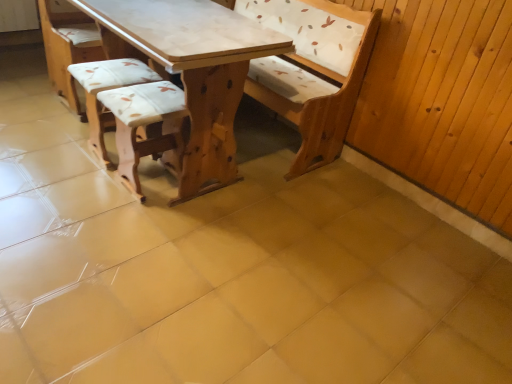
The image size is (512, 384). In order to click on white fabric cushion at center, the first armchair in the left-to-right sequence in this screenshot , I will do `click(106, 89)`.

Find the location of a particular element. Image resolution: width=512 pixels, height=384 pixels. wooden textured stool at center, which is the first armchair in right-to-left order is located at coordinates (143, 124).

From the picture: What is the approximate height of light brown wood table at center?

light brown wood table at center is 30.42 inches in height.

Image resolution: width=512 pixels, height=384 pixels. What are the coordinates of `white fabric cushion at center, the first armchair in the left-to-right sequence` in the screenshot? It's located at [106, 89].

Could you tell me if white fabric cushion at center, positioned as the 2th armchair in right-to-left order, is facing light brown wood table at center?

Yes, white fabric cushion at center, positioned as the 2th armchair in right-to-left order, is aimed at light brown wood table at center.

Is light brown wood table at center a part of white fabric cushion at center, positioned as the 2th armchair in right-to-left order?

No, light brown wood table at center is not surrounded by white fabric cushion at center, positioned as the 2th armchair in right-to-left order.

Is white fabric cushion at center, positioned as the 2th armchair in right-to-left order, taller than light brown wood table at center?

Incorrect, the height of white fabric cushion at center, positioned as the 2th armchair in right-to-left order, is not larger of that of light brown wood table at center.

From the image's perspective, is white fabric cushion at center, positioned as the 2th armchair in right-to-left order, above light brown wood table at center?

No, from the image's perspective, white fabric cushion at center, positioned as the 2th armchair in right-to-left order, is not on top of light brown wood table at center.

Does light brown wood table at center turn towards wooden textured stool at center, which is the first armchair in right-to-left order?

No, light brown wood table at center is not turned towards wooden textured stool at center, which is the first armchair in right-to-left order.

Consider the image. Is light brown wood table at center situated inside wooden textured stool at center, the second armchair positioned from the left, or outside?

light brown wood table at center exists outside the volume of wooden textured stool at center, the second armchair positioned from the left.

You are a GUI agent. You are given a task and a screenshot of the screen. Output one action in this format:
    pyautogui.click(x=<x>, y=<y>)
    Task: Click on the table above the wooden textured stool at center, the second armchair positioned from the left (from the image's perspective)
    
    Given the screenshot: What is the action you would take?
    pyautogui.click(x=183, y=84)

From the image's perspective, relative to wooden textured stool at center, the second armchair positioned from the left, is light brown wood table at center above or below?

light brown wood table at center is above wooden textured stool at center, the second armchair positioned from the left.

Which is in front, light brown wood table at center or white fabric cushion at center, positioned as the 2th armchair in right-to-left order?

light brown wood table at center is more forward.

Is light brown wood table at center facing away from white fabric cushion at center, positioned as the 2th armchair in right-to-left order?

No, light brown wood table at center is not facing the opposite direction of white fabric cushion at center, positioned as the 2th armchair in right-to-left order.

What are the coordinates of `table above the white fabric cushion at center, the first armchair in the left-to-right sequence (from the image's perspective)` in the screenshot? It's located at pyautogui.click(x=183, y=84).

Could you tell me if white fabric cushion at center, the first armchair in the left-to-right sequence, is facing wooden textured stool at center, the second armchair positioned from the left?

No, white fabric cushion at center, the first armchair in the left-to-right sequence, is not aimed at wooden textured stool at center, the second armchair positioned from the left.

Between point (157, 79) and point (117, 99), which one is positioned behind?

The point (157, 79) is behind.

Are white fabric cushion at center, the first armchair in the left-to-right sequence, and wooden textured stool at center, the second armchair positioned from the left, located far from each other?

They are positioned close to each other.

In terms of width, does white fabric cushion at center, positioned as the 2th armchair in right-to-left order, look wider or thinner when compared to wooden textured stool at center, the second armchair positioned from the left?

white fabric cushion at center, positioned as the 2th armchair in right-to-left order, is thinner than wooden textured stool at center, the second armchair positioned from the left.

Is wooden textured stool at center, the second armchair positioned from the left, aimed at light brown wood table at center?

Yes, wooden textured stool at center, the second armchair positioned from the left, is oriented towards light brown wood table at center.

Which is more to the right, wooden textured stool at center, which is the first armchair in right-to-left order, or light brown wood table at center?

light brown wood table at center is more to the right.

From the image's perspective, relative to light brown wood table at center, is wooden textured stool at center, the second armchair positioned from the left, above or below?

wooden textured stool at center, the second armchair positioned from the left, is situated lower than light brown wood table at center in the image.

Is wooden textured stool at center, which is the first armchair in right-to-left order, far away from light brown wood table at center?

No.

Considering the relative sizes of wooden textured stool at center, which is the first armchair in right-to-left order, and white fabric cushion at center, positioned as the 2th armchair in right-to-left order, in the image provided, is wooden textured stool at center, which is the first armchair in right-to-left order, thinner than white fabric cushion at center, positioned as the 2th armchair in right-to-left order,?

No.

Which of these two, wooden textured stool at center, the second armchair positioned from the left, or white fabric cushion at center, the first armchair in the left-to-right sequence, stands taller?

wooden textured stool at center, the second armchair positioned from the left.

From a real-world perspective, which is physically above, wooden textured stool at center, which is the first armchair in right-to-left order, or white fabric cushion at center, the first armchair in the left-to-right sequence?

In real-world perspective, wooden textured stool at center, which is the first armchair in right-to-left order, is above.

From the image's perspective, which one is positioned higher, wooden textured stool at center, which is the first armchair in right-to-left order, or white fabric cushion at center, the first armchair in the left-to-right sequence?

white fabric cushion at center, the first armchair in the left-to-right sequence.

Image resolution: width=512 pixels, height=384 pixels. I want to click on armchair that is the 2nd object to the left of the light brown wood table at center, starting at the anchor, so click(x=106, y=89).

Locate an element on the screen. The height and width of the screenshot is (384, 512). table that appears above the wooden textured stool at center, which is the first armchair in right-to-left order (from the image's perspective) is located at coordinates (183, 84).

Estimate the real-world distances between objects in this image. Which object is further from wooden textured stool at center, the second armchair positioned from the left, light brown wood table at center or white fabric cushion at center, positioned as the 2th armchair in right-to-left order?

white fabric cushion at center, positioned as the 2th armchair in right-to-left order.

Which object lies nearer to the anchor point white fabric cushion at center, the first armchair in the left-to-right sequence, wooden textured stool at center, the second armchair positioned from the left, or light brown wood table at center?

Among the two, wooden textured stool at center, the second armchair positioned from the left, is located nearer to white fabric cushion at center, the first armchair in the left-to-right sequence.

Which object lies further to the anchor point light brown wood table at center, wooden textured stool at center, which is the first armchair in right-to-left order, or white fabric cushion at center, the first armchair in the left-to-right sequence?

The object further to light brown wood table at center is white fabric cushion at center, the first armchair in the left-to-right sequence.

Which object lies further to the anchor point white fabric cushion at center, the first armchair in the left-to-right sequence, light brown wood table at center or wooden textured stool at center, the second armchair positioned from the left?

light brown wood table at center is further to white fabric cushion at center, the first armchair in the left-to-right sequence.

Estimate the real-world distances between objects in this image. Which object is closer to light brown wood table at center, white fabric cushion at center, the first armchair in the left-to-right sequence, or wooden textured stool at center, which is the first armchair in right-to-left order?

Based on the image, wooden textured stool at center, which is the first armchair in right-to-left order, appears to be nearer to light brown wood table at center.

Based on their spatial positions, is white fabric cushion at center, the first armchair in the left-to-right sequence, or light brown wood table at center further from wooden textured stool at center, the second armchair positioned from the left?

white fabric cushion at center, the first armchair in the left-to-right sequence.

This screenshot has width=512, height=384. In order to click on armchair between light brown wood table at center and white fabric cushion at center, the first armchair in the left-to-right sequence, in the front-back direction in this screenshot , I will do `click(143, 124)`.